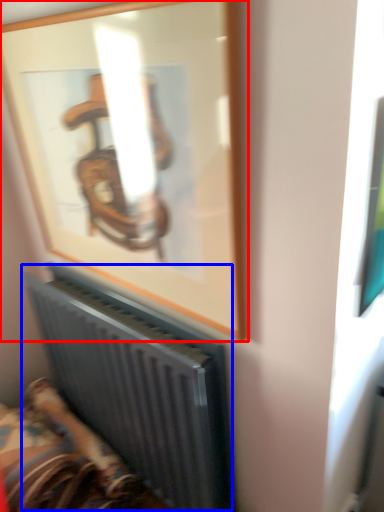
Question: Which of the following is the closest to the observer, picture frame (highlighted by a red box) or radiator (highlighted by a blue box)?

Choices:
 (A) picture frame
 (B) radiator

Answer: (A)